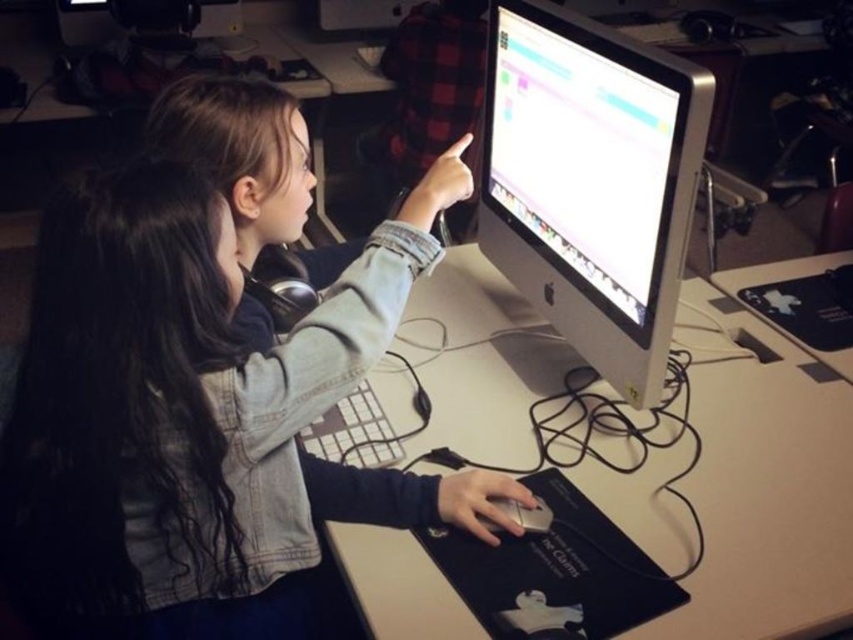
You are standing in front of the computer workstation described in the scene. Where is the white matte table at center located in terms of its 2D coordinates?

The white matte table at center is located at the 2D coordinates point (762, 481).

You are a photographer taking a picture of the scene. You want to ensure both the denim jacket at center and the white matte table at center are clearly visible in your shot. Based on their positions, which object should you position closer to the left side of your frame?

The denim jacket at center is to the left of the white matte table at center, so you should position the denim jacket at center closer to the left side of your frame to ensure both are visible.